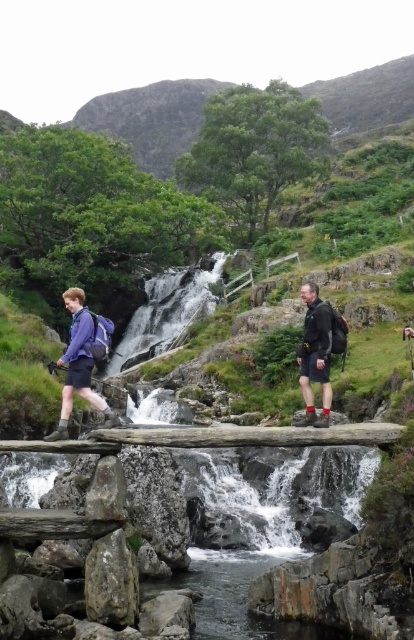
You are a hiker planning to cross the rustic wooden bridge over the waterfall. You see the matte purple jacket at left and the matte black backpack at center. Which object is positioned closer to the left side of the bridge?

The matte purple jacket at left is positioned closer to the left side of the bridge than the matte black backpack at center.